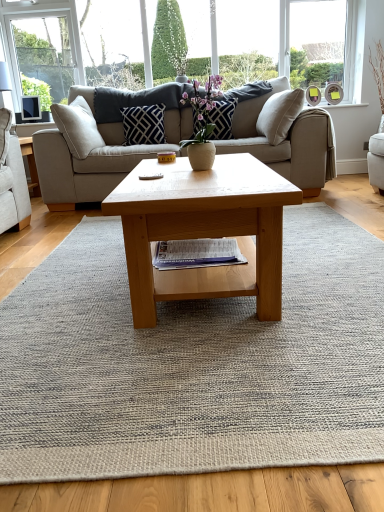
The height and width of the screenshot is (512, 384). What are the coordinates of `free region on the left part of light brown wooden coffee table at center` in the screenshot? It's located at (59, 282).